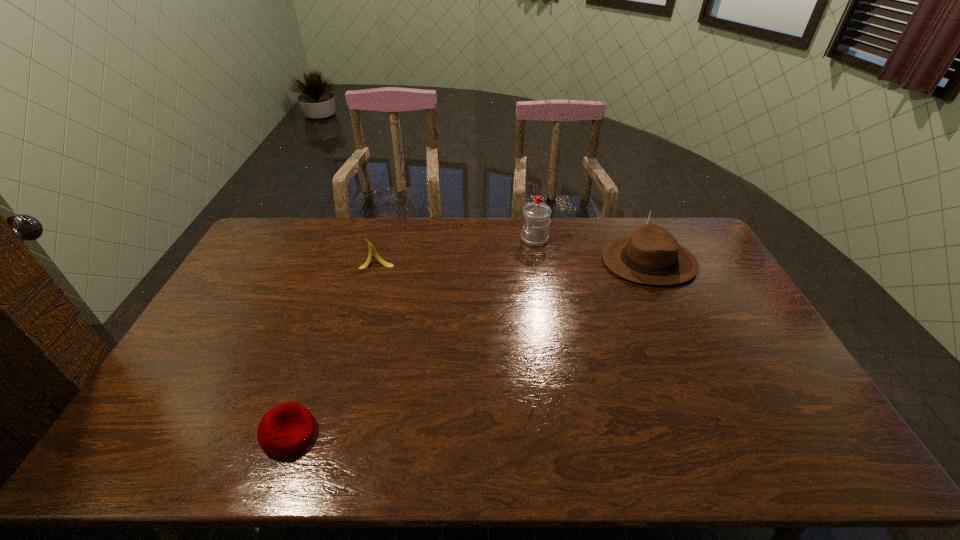
At what (x,y) coordinates should I click in order to perform the action: click on the third object from left to right. Please return your answer as a coordinate pair (x, y). This screenshot has width=960, height=540. Looking at the image, I should click on (536, 214).

Image resolution: width=960 pixels, height=540 pixels. Identify the location of water bottle. (536, 214).

Where is `fedora`? Image resolution: width=960 pixels, height=540 pixels. fedora is located at coordinates (651, 255).

Identify the location of the rightmost object. The image size is (960, 540). (651, 255).

Where is `the second shortest object`? This screenshot has height=540, width=960. the second shortest object is located at coordinates (372, 251).

The width and height of the screenshot is (960, 540). Identify the location of the nearest object. (286, 429).

Where is `the shortest object`? the shortest object is located at coordinates point(286,429).

Find the location of a particular element. The height and width of the screenshot is (540, 960). vacant region located 0.060m on the handle side of the tallest object is located at coordinates (505, 239).

This screenshot has width=960, height=540. In order to click on free space located on the handle side of the tallest object in this screenshot , I will do `click(490, 239)`.

Find the location of a particular element. The height and width of the screenshot is (540, 960). vacant space situated 0.130m on the handle side of the tallest object is located at coordinates (487, 239).